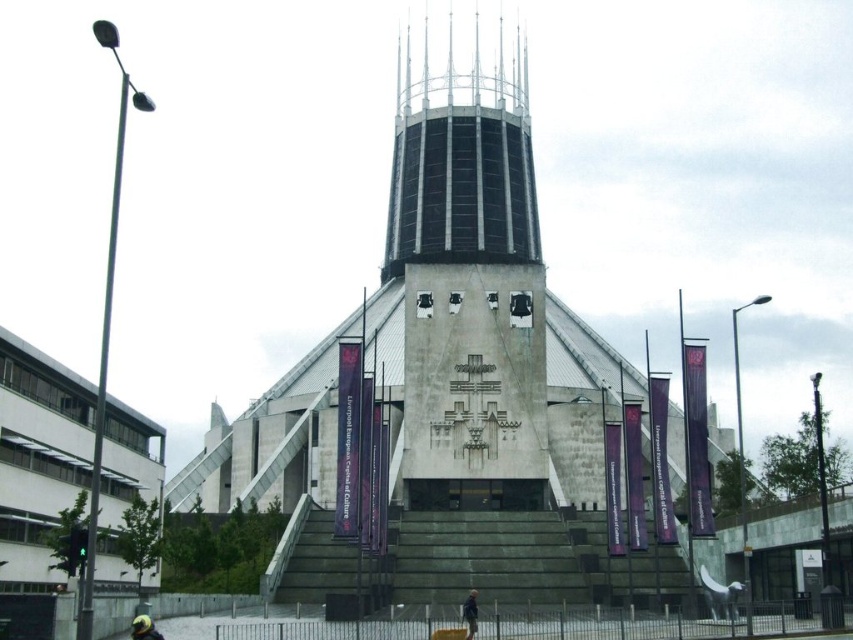
You are standing in front of the Liverpool Anglican Cathedral and see the black glass spire at center and the dark blue jacket at center. Which object is positioned more to the right side?

The black glass spire at center is positioned more to the right side than the dark blue jacket at center.

You are standing at the bottom of the steps leading to the Liverpool Anglican Cathedral. You see a black glass spire at center and a dark blue jacket at center. Which object is higher in the scene?

The black glass spire at center is positioned over the dark blue jacket at center, so it is higher in the scene.